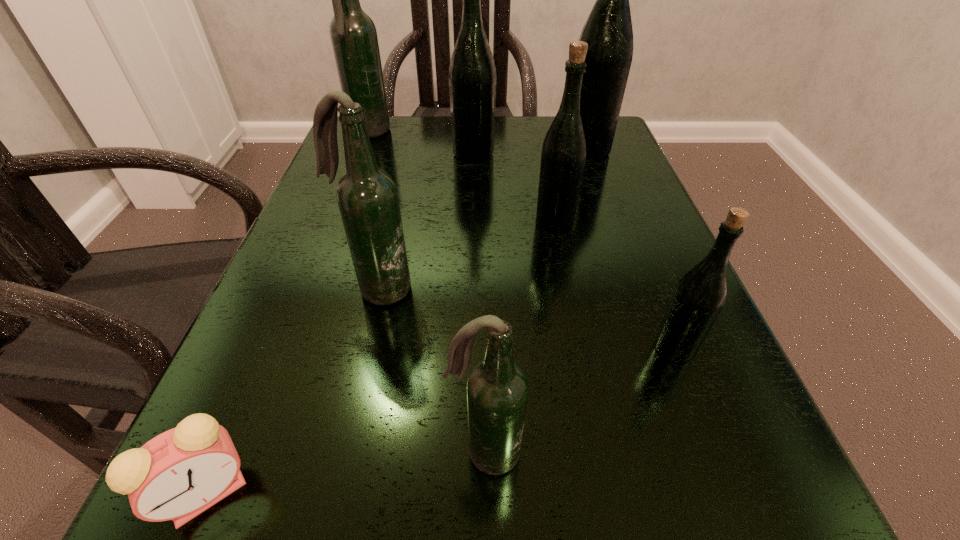
Identify the location of the biggest green beer bottle. point(608,31).

Image resolution: width=960 pixels, height=540 pixels. Identify the location of the tallest object. (608, 31).

I want to click on the farthest dark beer bottle, so click(x=353, y=34).

You are a GUI agent. You are given a task and a screenshot of the screen. Output one action in this format:
    pyautogui.click(x=<x>, y=<y>)
    Task: Click on the leftmost dark beer bottle
    The height and width of the screenshot is (540, 960).
    Given the screenshot: What is the action you would take?
    pyautogui.click(x=353, y=34)

Where is `the leftmost green beer bottle`? the leftmost green beer bottle is located at coordinates (472, 73).

Identify the location of the third beer bottle from right to left. (563, 156).

Find the location of a particular element. This screenshot has width=960, height=540. the second green beer bottle from left to right is located at coordinates (563, 156).

Where is `the second nearest dark beer bottle`? the second nearest dark beer bottle is located at coordinates (367, 197).

Identify the location of the third nearest beer bottle. The image size is (960, 540). (367, 197).

You are a GUI agent. You are given a task and a screenshot of the screen. Output one action in this format:
    pyautogui.click(x=<x>, y=<y>)
    Task: Click on the nearest green beer bottle
    The image size is (960, 540).
    Given the screenshot: What is the action you would take?
    pyautogui.click(x=698, y=298)